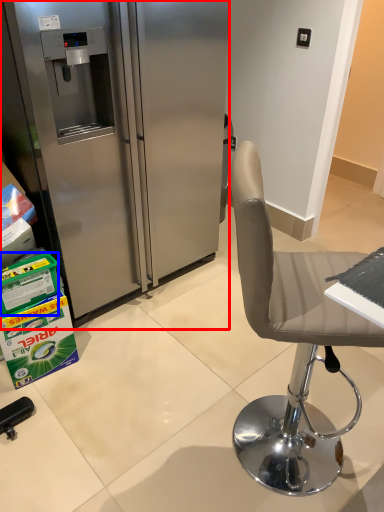
Question: Which of the following is the farthest to the observer, refrigerator (highlighted by a red box) or box (highlighted by a blue box)?

Choices:
 (A) refrigerator
 (B) box

Answer: (B)